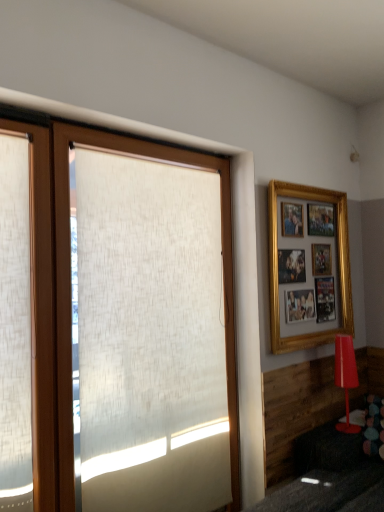
Image resolution: width=384 pixels, height=512 pixels. Describe the element at coordinates (70, 294) in the screenshot. I see `white textured roller blind at left` at that location.

What is the approximate height of wooden shutter at left?

wooden shutter at left is 1.73 meters in height.

What do you see at coordinates (338, 265) in the screenshot? I see `gold/gilded picture frame at upper right` at bounding box center [338, 265].

You are a GUI agent. You are given a task and a screenshot of the screen. Output one action in this format:
    pyautogui.click(x=<x>, y=<y>)
    Task: Click on the gold/gilded picture frame at upper right
    The height and width of the screenshot is (512, 384).
    Given the screenshot: What is the action you would take?
    pyautogui.click(x=338, y=265)

Locate an element on the screen. This screenshot has height=512, width=384. white textured roller blind at left is located at coordinates (70, 294).

Is gold/gilded picture frame at upper right completely or partially inside wooden shutter at left?

No, gold/gilded picture frame at upper right is not inside wooden shutter at left.

From a real-world perspective, is wooden shutter at left located higher than gold/gilded picture frame at upper right?

Incorrect, from a real-world perspective, wooden shutter at left is lower than gold/gilded picture frame at upper right.

From the image's perspective, is wooden shutter at left above or below gold/gilded picture frame at upper right?

Based on their image positions, wooden shutter at left is located beneath gold/gilded picture frame at upper right.

Can you tell me how much gold/gilded picture frame at upper right and wooden shutter at left differ in facing direction?

gold/gilded picture frame at upper right and wooden shutter at left are facing 0.257 degrees away from each other.

Between point (341, 330) and point (8, 441), which one is positioned behind?

The point (341, 330) is behind.

Is wooden shutter at left at the back of gold/gilded picture frame at upper right?

No.

Is wooden shutter at left completely or partially inside gold/gilded picture frame at upper right?

Definitely not — wooden shutter at left is not inside gold/gilded picture frame at upper right.

From the image's perspective, is wooden shutter at left located above or below matte red lamp at lower right?

Based on their image positions, wooden shutter at left is located above matte red lamp at lower right.

Based on the photo, is wooden shutter at left oriented away from matte red lamp at lower right?

wooden shutter at left does not have its back to matte red lamp at lower right.

Is the depth of wooden shutter at left greater than that of matte red lamp at lower right?

No, wooden shutter at left is closer to the camera.

Looking at this image, are wooden shutter at left and matte red lamp at lower right making contact?

No, wooden shutter at left is not with matte red lamp at lower right.

Is white textured roller blind at left situated inside wooden shutter at left or outside?

white textured roller blind at left is outside wooden shutter at left.

Is white textured roller blind at left aimed at wooden shutter at left?

No, white textured roller blind at left is not facing towards wooden shutter at left.

Considering the relative sizes of white textured roller blind at left and wooden shutter at left in the image provided, is white textured roller blind at left bigger than wooden shutter at left?

Indeed, white textured roller blind at left has a larger size compared to wooden shutter at left.

Looking at this image, from the image's perspective, who appears lower, white textured roller blind at left or wooden shutter at left?

From the image's view, white textured roller blind at left is below.

You are a GUI agent. You are given a task and a screenshot of the screen. Output one action in this format:
    pyautogui.click(x=<x>, y=<y>)
    Task: Click on the picture frame above the matte red lamp at lower right (from a real-world perspective)
    The image size is (384, 512).
    Given the screenshot: What is the action you would take?
    pyautogui.click(x=338, y=265)

Consider the image. Which point is more distant from viewer, (272, 319) or (344, 426)?

Point (344, 426)

Is matte red lamp at lower right at the back of gold/gilded picture frame at upper right?

No, gold/gilded picture frame at upper right's orientation is not away from matte red lamp at lower right.

Based on the photo, from the image's perspective, is gold/gilded picture frame at upper right below matte red lamp at lower right?

Incorrect, from the image's perspective, gold/gilded picture frame at upper right is higher than matte red lamp at lower right.

Locate an element on the screen. This screenshot has height=512, width=384. lamp below the white textured roller blind at left (from a real-world perspective) is located at coordinates (345, 376).

Is white textured roller blind at left positioned with its back to matte red lamp at lower right?

white textured roller blind at left does not have its back to matte red lamp at lower right.

From the image's perspective, is white textured roller blind at left located above or below matte red lamp at lower right?

Based on their image positions, white textured roller blind at left is located above matte red lamp at lower right.

Who is taller, wooden shutter at left or white textured roller blind at left?

With more height is white textured roller blind at left.

Does wooden shutter at left have a smaller size compared to white textured roller blind at left?

Yes, wooden shutter at left is smaller than white textured roller blind at left.

Which is behind, wooden shutter at left or white textured roller blind at left?

white textured roller blind at left.

Can you see wooden shutter at left touching white textured roller blind at left?

No, wooden shutter at left is not touching white textured roller blind at left.

Find the location of a particular element. The image size is (384, 512). picture frame on the right of wooden shutter at left is located at coordinates (338, 265).

This screenshot has height=512, width=384. Find the location of `picture frame above the wooden shutter at left (from the image's perspective)`. picture frame above the wooden shutter at left (from the image's perspective) is located at coordinates (338, 265).

Which object lies nearer to the anchor point white textured roller blind at left, gold/gilded picture frame at upper right or wooden shutter at left?

wooden shutter at left.

Which object lies nearer to the anchor point wooden shutter at left, gold/gilded picture frame at upper right or matte red lamp at lower right?

The object closer to wooden shutter at left is gold/gilded picture frame at upper right.

Considering their positions, is matte red lamp at lower right positioned closer to white textured roller blind at left than gold/gilded picture frame at upper right?

gold/gilded picture frame at upper right.

Based on their spatial positions, is white textured roller blind at left or matte red lamp at lower right closer to gold/gilded picture frame at upper right?

matte red lamp at lower right is positioned closer to the anchor gold/gilded picture frame at upper right.

From the image, which object appears to be nearer to wooden shutter at left, white textured roller blind at left or gold/gilded picture frame at upper right?

white textured roller blind at left.

Based on their spatial positions, is wooden shutter at left or matte red lamp at lower right closer to gold/gilded picture frame at upper right?

The object closer to gold/gilded picture frame at upper right is matte red lamp at lower right.

In the scene shown: Estimate the real-world distances between objects in this image. Which object is closer to white textured roller blind at left, gold/gilded picture frame at upper right or matte red lamp at lower right?

gold/gilded picture frame at upper right is closer to white textured roller blind at left.

Based on their spatial positions, is wooden shutter at left or gold/gilded picture frame at upper right further from white textured roller blind at left?

Among the two, gold/gilded picture frame at upper right is located further to white textured roller blind at left.

You are a GUI agent. You are given a task and a screenshot of the screen. Output one action in this format:
    pyautogui.click(x=<x>, y=<y>)
    Task: Click on the picture frame located between wooden shutter at left and matte red lamp at lower right in the left-right direction
    The height and width of the screenshot is (512, 384).
    Given the screenshot: What is the action you would take?
    pyautogui.click(x=338, y=265)

Locate an element on the screen. The image size is (384, 512). window between wooden shutter at left and gold/gilded picture frame at upper right from left to right is located at coordinates (70, 294).

Find the location of a particular element. Image resolution: width=384 pixels, height=512 pixels. picture frame between white textured roller blind at left and matte red lamp at lower right from left to right is located at coordinates (338, 265).

Where is `window between wooden shutter at left and matte red lamp at lower right from left to right`? window between wooden shutter at left and matte red lamp at lower right from left to right is located at coordinates (70, 294).